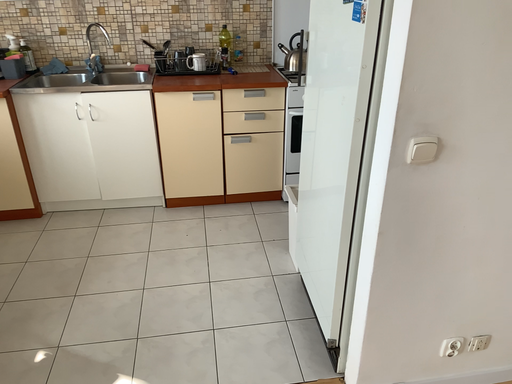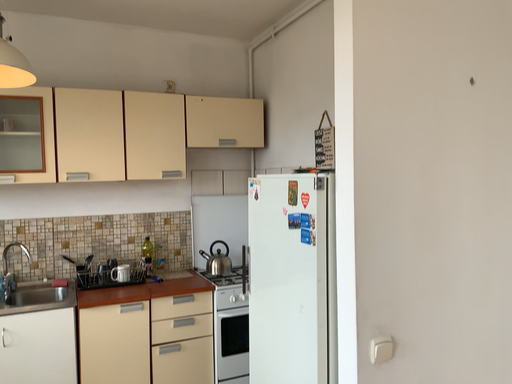
Question: Which way did the camera rotate in the video?

Choices:
 (A) rotated upward
 (B) rotated downward

Answer: (A)